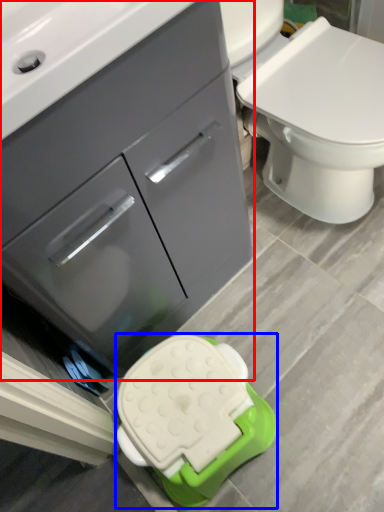
Question: Which object appears closest to the camera in this image, bathroom cabinet (highlighted by a red box) or porcelain (highlighted by a blue box)?

Choices:
 (A) bathroom cabinet
 (B) porcelain

Answer: (A)